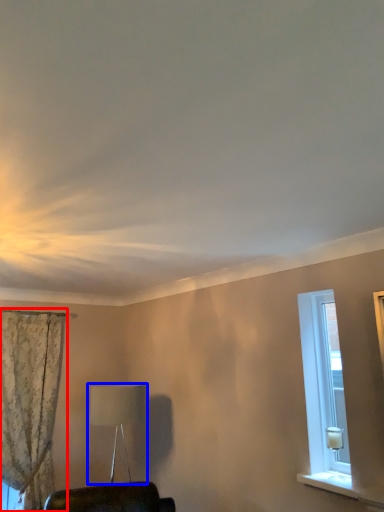
Question: Which of the following is the closest to the observer, curtain (highlighted by a red box) or table lamp (highlighted by a blue box)?

Choices:
 (A) curtain
 (B) table lamp

Answer: (B)